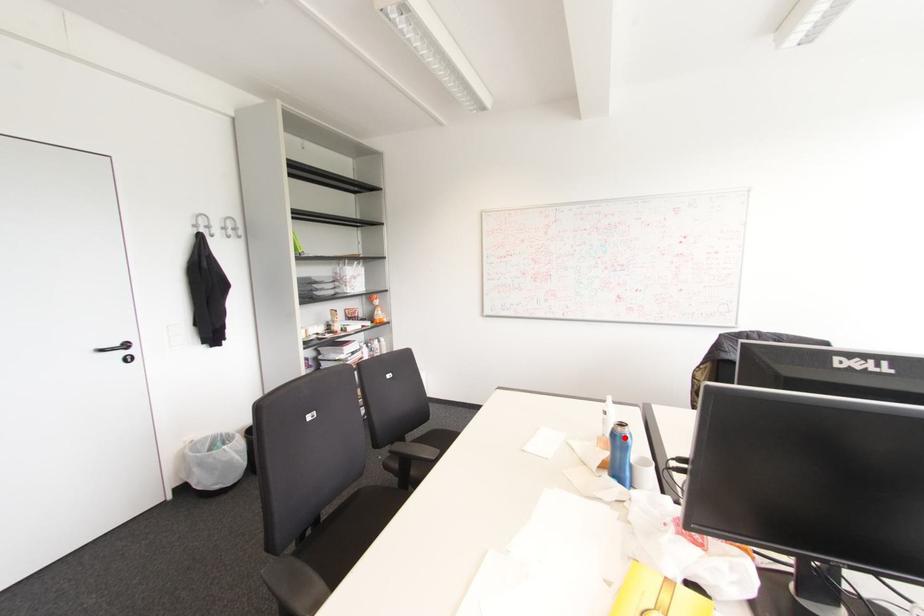
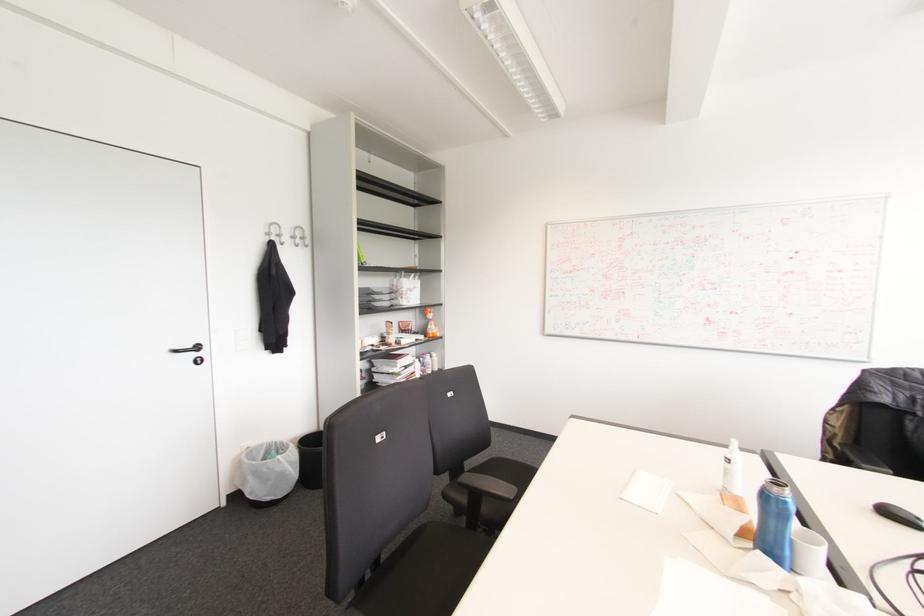
Find the pixel in the second image that matches the highlighted location in the first image.

(784, 503)